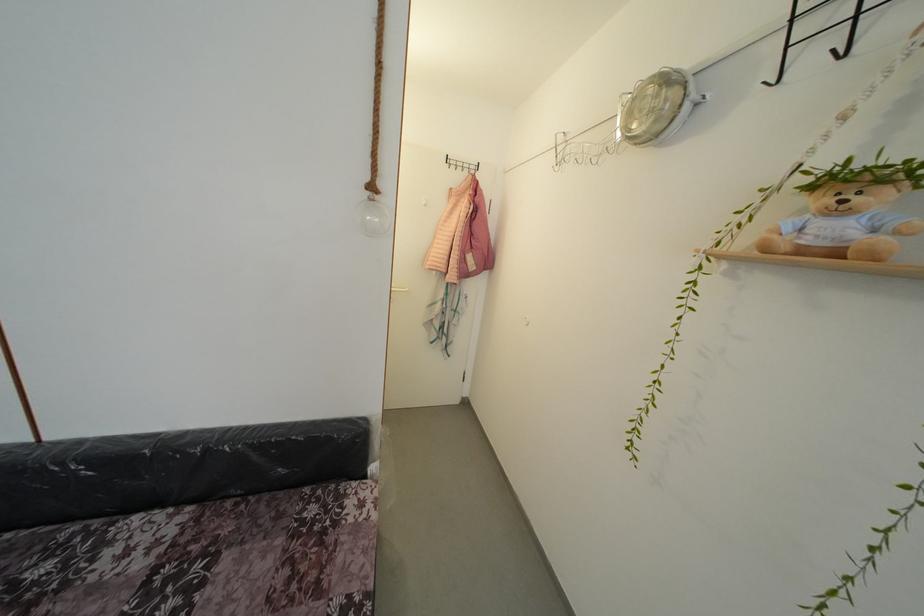
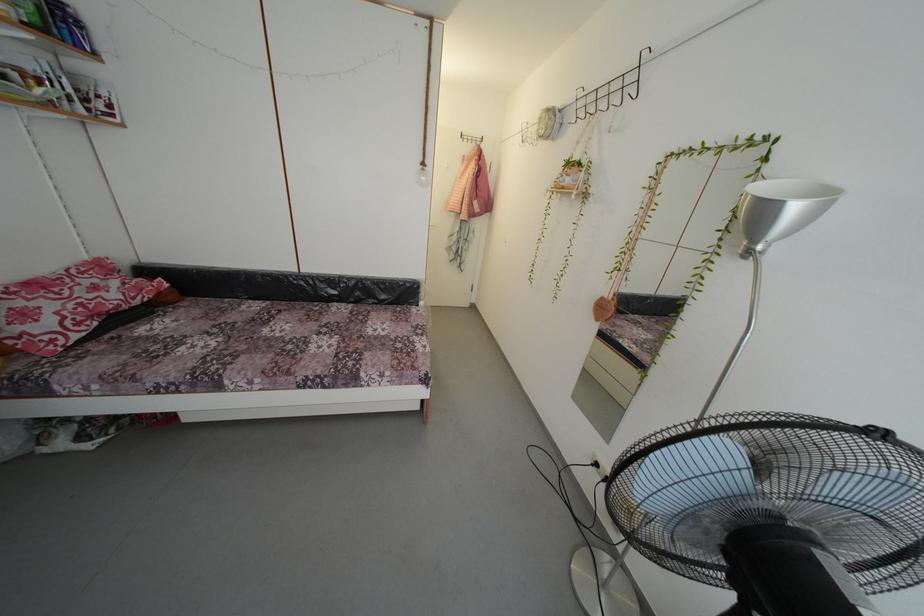
Find the pixel in the second image that matches point (378, 193) in the first image.

(429, 169)